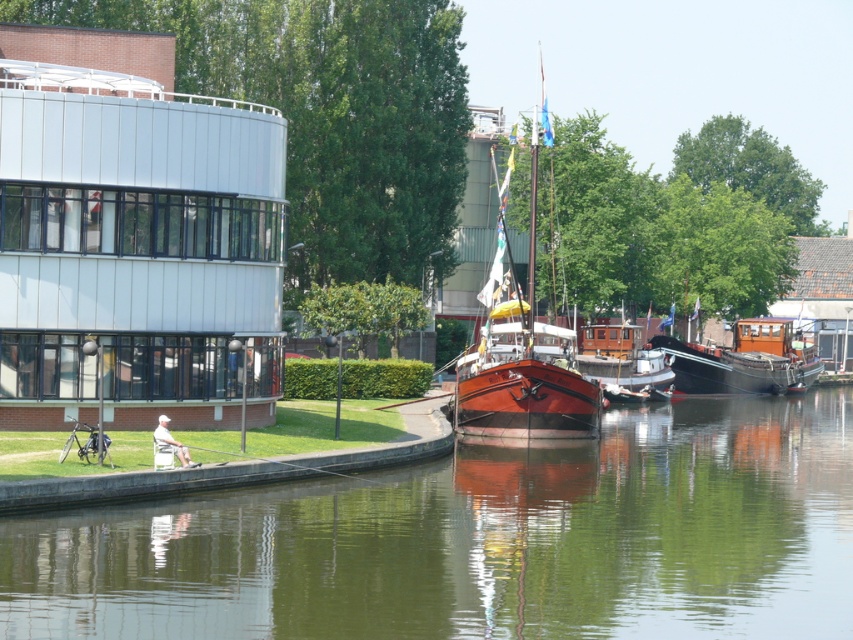
Question: Is green smooth water at center closer to the viewer compared to wooden boat at center?

Choices:
 (A) no
 (B) yes

Answer: (B)

Question: Considering the relative positions of green smooth water at center and white fabric at lower left in the image provided, where is green smooth water at center located with respect to white fabric at lower left?

Choices:
 (A) below
 (B) above

Answer: (A)

Question: Among these points, which one is farthest from the camera?

Choices:
 (A) (477, 429)
 (B) (543, 532)

Answer: (A)

Question: Is the position of wooden boat at center less distant than that of white fabric at lower left?

Choices:
 (A) yes
 (B) no

Answer: (B)

Question: Which object is the farthest from the shiny brown wooden boat at center?

Choices:
 (A) green smooth water at center
 (B) wooden boat at center
 (C) wooden polished boat at right

Answer: (C)

Question: Which of the following is the farthest from the observer?

Choices:
 (A) white fabric at lower left
 (B) shiny brown wooden boat at center

Answer: (B)